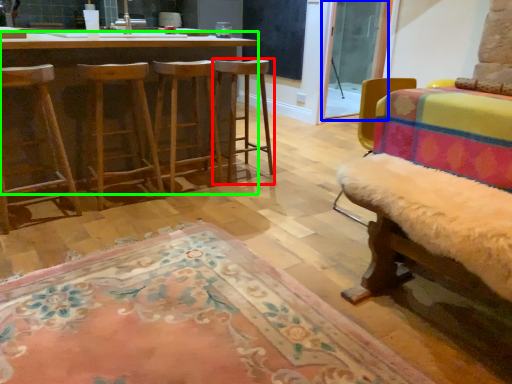
Question: Which object is positioned farthest from stool (highlighted by a red box)? Select from screen door (highlighted by a blue box) and desk (highlighted by a green box).

Choices:
 (A) screen door
 (B) desk

Answer: (A)